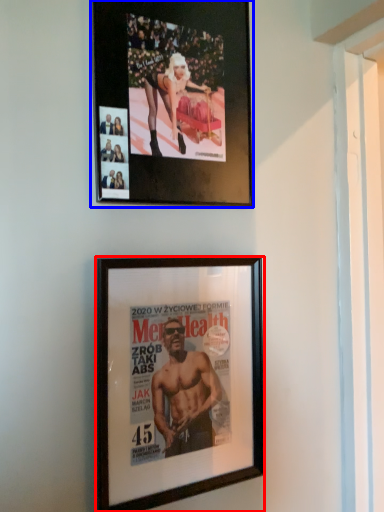
Question: Among these objects, which one is nearest to the camera, picture frame (highlighted by a red box) or picture frame (highlighted by a blue box)?

Choices:
 (A) picture frame
 (B) picture frame

Answer: (A)